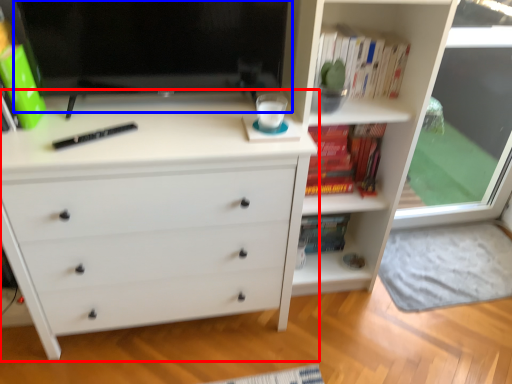
Question: Which object appears farthest to the camera in this image, chest of drawers (highlighted by a red box) or computer monitor (highlighted by a blue box)?

Choices:
 (A) chest of drawers
 (B) computer monitor

Answer: (B)